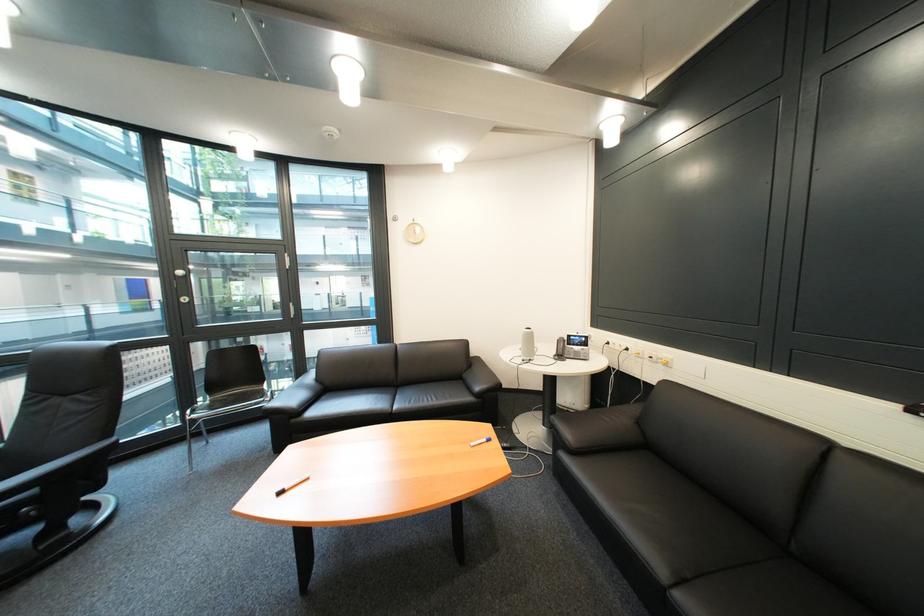
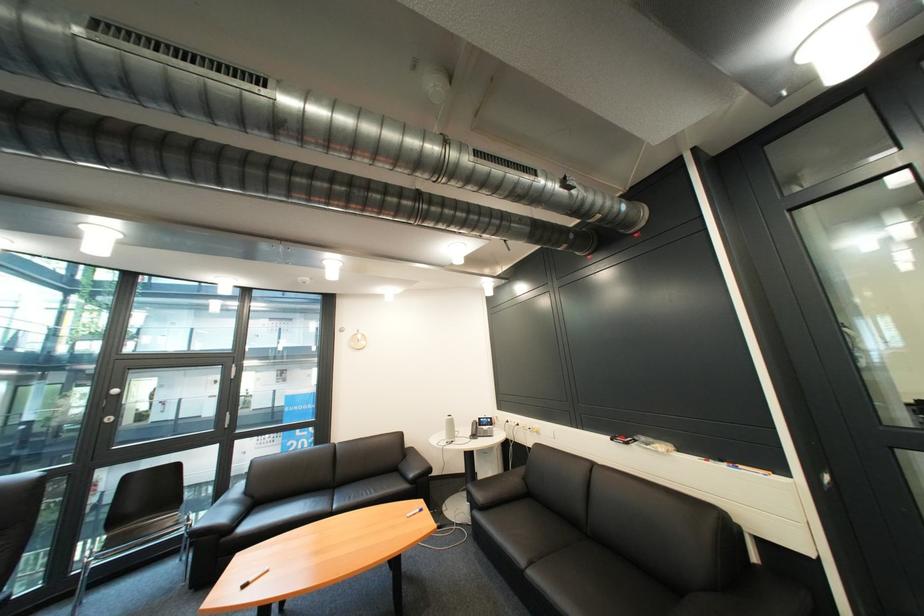
Find the pixel in the second image that matches [582,338] in the first image.

(492, 419)